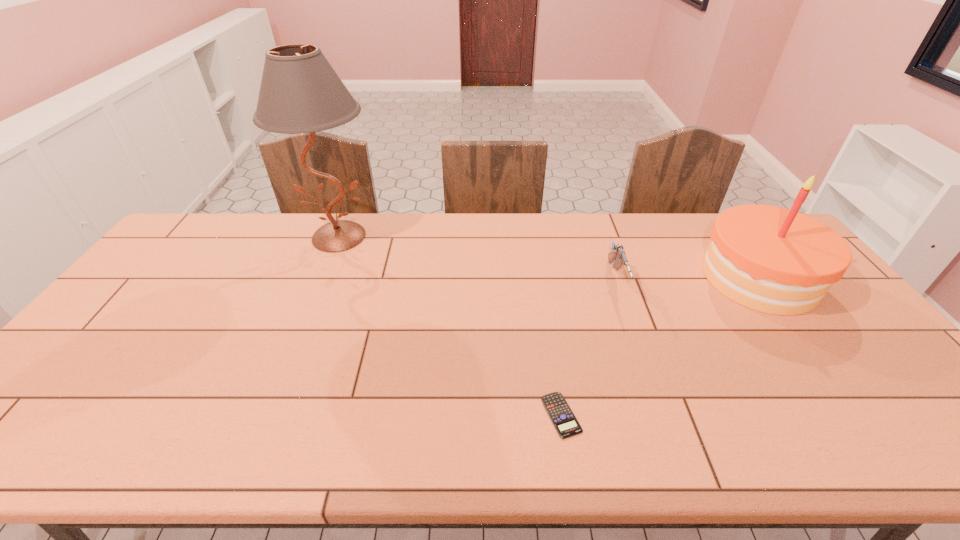
I want to click on the tallest object, so click(x=300, y=92).

The height and width of the screenshot is (540, 960). What are the coordinates of `the leftmost object` in the screenshot? It's located at (300, 92).

At what (x,y) coordinates should I click in order to perform the action: click on the rightmost object. Please return your answer as a coordinate pair (x, y). This screenshot has height=540, width=960. Looking at the image, I should click on (770, 259).

Identify the location of birthday cake. The image size is (960, 540). (770, 259).

At what (x,y) coordinates should I click in order to perform the action: click on gun. Please return your answer as a coordinate pair (x, y). Image resolution: width=960 pixels, height=540 pixels. Looking at the image, I should click on (618, 255).

The height and width of the screenshot is (540, 960). I want to click on the third object from left to right, so click(x=618, y=255).

This screenshot has width=960, height=540. What are the coordinates of `the nearest object` in the screenshot? It's located at (557, 408).

The height and width of the screenshot is (540, 960). I want to click on the second object from left to right, so click(557, 408).

Image resolution: width=960 pixels, height=540 pixels. What are the coordinates of `vacant space located 0.360m on the front-facing side of the leftmost object` in the screenshot? It's located at (292, 352).

I want to click on free region located on the left of the birthday cake, so click(x=660, y=278).